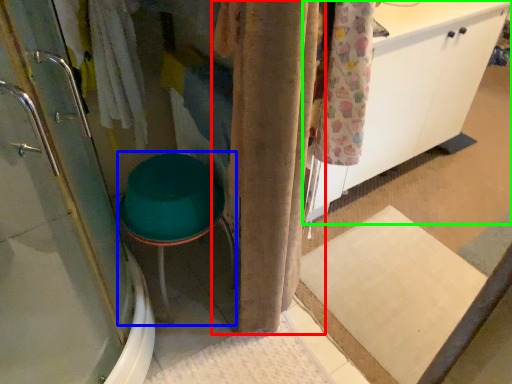
Question: Which is nearer to the curtain (highlighted by a red box)? step stool (highlighted by a blue box) or cabinetry (highlighted by a green box).

Choices:
 (A) step stool
 (B) cabinetry

Answer: (A)